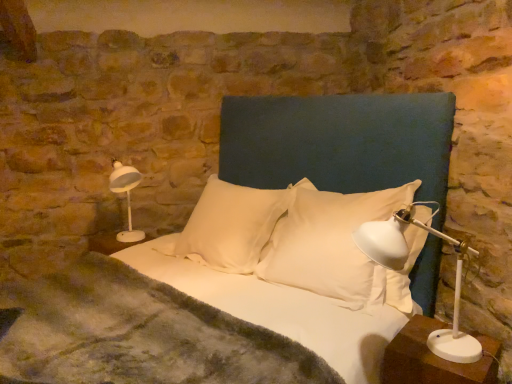
Question: Can white plastic table lamp at right, positioned as the second table lamp in left-to-right order, be found inside white plastic nightstand at lower right?

Choices:
 (A) yes
 (B) no

Answer: (B)

Question: Is white plastic nightstand at lower right thinner than white plastic table lamp at right, arranged as the 1th table lamp when viewed from the right?

Choices:
 (A) yes
 (B) no

Answer: (A)

Question: Considering the relative positions of white plastic nightstand at lower right and white plastic table lamp at right, positioned as the second table lamp in left-to-right order, in the image provided, is white plastic nightstand at lower right behind white plastic table lamp at right, positioned as the second table lamp in left-to-right order,?

Choices:
 (A) yes
 (B) no

Answer: (A)

Question: From a real-world perspective, is white plastic nightstand at lower right physically below white plastic table lamp at right, positioned as the second table lamp in left-to-right order?

Choices:
 (A) yes
 (B) no

Answer: (A)

Question: Does white plastic nightstand at lower right have a greater height compared to white plastic table lamp at right, arranged as the 2th table lamp when viewed from the back?

Choices:
 (A) yes
 (B) no

Answer: (B)

Question: Looking at the image, does dark blue fabric headboard at center seem bigger or smaller compared to white glossy table lamp at left, which appears as the second table lamp when viewed from the right?

Choices:
 (A) small
 (B) big

Answer: (B)

Question: Is dark blue fabric headboard at center situated inside white glossy table lamp at left, which appears as the 1th table lamp when viewed from the back, or outside?

Choices:
 (A) outside
 (B) inside

Answer: (A)

Question: From the image's perspective, is dark blue fabric headboard at center located above or below white glossy table lamp at left, acting as the second table lamp starting from the front?

Choices:
 (A) below
 (B) above

Answer: (A)

Question: Is dark blue fabric headboard at center to the left or to the right of white glossy table lamp at left, which appears as the 1th table lamp when viewed from the left, in the image?

Choices:
 (A) left
 (B) right

Answer: (B)

Question: From the image's perspective, relative to dark blue fabric headboard at center, is white soft pillow at center, arranged as the 1th pillow when viewed from the right, above or below?

Choices:
 (A) below
 (B) above

Answer: (A)

Question: In terms of size, does white soft pillow at center, marked as the second pillow in a left-to-right arrangement, appear bigger or smaller than dark blue fabric headboard at center?

Choices:
 (A) big
 (B) small

Answer: (B)

Question: Would you say white soft pillow at center, marked as the second pillow in a left-to-right arrangement, is to the left or to the right of dark blue fabric headboard at center in the picture?

Choices:
 (A) left
 (B) right

Answer: (B)

Question: Is white soft pillow at center, marked as the second pillow in a left-to-right arrangement, in front of or behind dark blue fabric headboard at center in the image?

Choices:
 (A) behind
 (B) front

Answer: (A)

Question: From a real-world perspective, relative to dark blue fabric headboard at center, is white glossy table lamp at left, which appears as the 1th table lamp when viewed from the left, vertically above or below?

Choices:
 (A) below
 (B) above

Answer: (B)

Question: From the image's perspective, is white glossy table lamp at left, which appears as the 1th table lamp when viewed from the left, positioned above or below dark blue fabric headboard at center?

Choices:
 (A) below
 (B) above

Answer: (B)